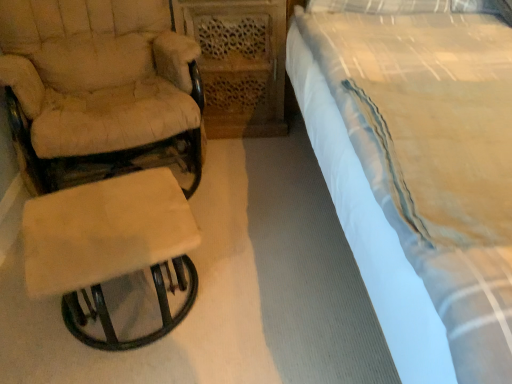
Describe the element at coordinates (110, 247) in the screenshot. I see `beige fabric stool at left` at that location.

Locate an element on the screen. The width and height of the screenshot is (512, 384). beige fabric chair at left is located at coordinates (100, 98).

Image resolution: width=512 pixels, height=384 pixels. In order to click on beige fabric stool at left in this screenshot , I will do `click(110, 247)`.

Does beige fabric stool at left turn towards beige fabric chair at left?

No, beige fabric stool at left does not turn towards beige fabric chair at left.

Considering the relative positions of beige fabric stool at left and beige fabric chair at left in the image provided, is beige fabric stool at left to the left or to the right of beige fabric chair at left?

From the image, it's evident that beige fabric stool at left is to the right of beige fabric chair at left.

Is beige fabric stool at left inside or outside of beige fabric chair at left?

beige fabric stool at left is located beyond the bounds of beige fabric chair at left.

Is white cotton bed at right positioned far away from beige fabric chair at left?

They are positioned close to each other.

Is beige fabric chair at left at the back of white cotton bed at right?

No, beige fabric chair at left is not at the back of white cotton bed at right.

The height and width of the screenshot is (384, 512). In order to click on bed below the beige fabric chair at left (from the image's perspective) in this screenshot , I will do `click(435, 157)`.

What's the angular difference between beige fabric stool at left and white cotton bed at right's facing directions?

There is a 18.2-degree angle between the facing directions of beige fabric stool at left and white cotton bed at right.

Considering their positions, is beige fabric stool at left located in front of or behind white cotton bed at right?

Clearly, beige fabric stool at left is behind white cotton bed at right.

At what (x,y) coordinates should I click in order to perform the action: click on table below the white cotton bed at right (from the image's perspective). Please return your answer as a coordinate pair (x, y). The width and height of the screenshot is (512, 384). Looking at the image, I should click on (110, 247).

Could you tell me if beige fabric chair at left is turned towards white cotton bed at right?

No, beige fabric chair at left is not facing towards white cotton bed at right.

From the image's perspective, relative to white cotton bed at right, is beige fabric chair at left above or below?

beige fabric chair at left is situated higher than white cotton bed at right in the image.

Is beige fabric chair at left to the right of white cotton bed at right from the viewer's perspective?

No.

Is white cotton bed at right inside the boundaries of beige fabric stool at left, or outside?

white cotton bed at right cannot be found inside beige fabric stool at left.

Which object is closer to the camera, white cotton bed at right or beige fabric stool at left?

white cotton bed at right.

Are white cotton bed at right and beige fabric stool at left far apart?

No, white cotton bed at right is in close proximity to beige fabric stool at left.

From the image's perspective, who appears lower, white cotton bed at right or beige fabric stool at left?

beige fabric stool at left.

Considering the relative sizes of beige fabric chair at left and beige fabric stool at left in the image provided, is beige fabric chair at left wider than beige fabric stool at left?

Yes.

From a real-world perspective, is beige fabric chair at left positioned above or below beige fabric stool at left?

From a real-world perspective, beige fabric chair at left is physically above beige fabric stool at left.

Considering the positions of point (149, 121) and point (134, 251), is point (149, 121) closer or farther from the camera than point (134, 251)?

Point (149, 121) is positioned farther from the camera compared to point (134, 251).

Looking at this image, is beige fabric chair at left placed right next to beige fabric stool at left?

beige fabric chair at left and beige fabric stool at left are not in contact.

Where is `table in front of the beige fabric chair at left`? The image size is (512, 384). table in front of the beige fabric chair at left is located at coordinates (110, 247).

Locate an element on the screen. chair below the white cotton bed at right (from a real-world perspective) is located at coordinates (100, 98).

When comparing their distances from white cotton bed at right, does beige fabric stool at left or beige fabric chair at left seem further?

beige fabric chair at left is further to white cotton bed at right.

In the scene shown: Looking at the image, which one is located further to white cotton bed at right, beige fabric chair at left or beige fabric stool at left?

beige fabric chair at left is positioned further to the anchor white cotton bed at right.

Which object lies nearer to the anchor point beige fabric stool at left, beige fabric chair at left or white cotton bed at right?

Based on the image, beige fabric chair at left appears to be nearer to beige fabric stool at left.

When comparing their distances from beige fabric chair at left, does white cotton bed at right or beige fabric stool at left seem closer?

Among the two, beige fabric stool at left is located nearer to beige fabric chair at left.

From the image, which object appears to be nearer to beige fabric stool at left, white cotton bed at right or beige fabric chair at left?

beige fabric chair at left.

From the image, which object appears to be nearer to beige fabric chair at left, beige fabric stool at left or white cotton bed at right?

Among the two, beige fabric stool at left is located nearer to beige fabric chair at left.

The height and width of the screenshot is (384, 512). Identify the location of table situated between beige fabric chair at left and white cotton bed at right from left to right. (110, 247).